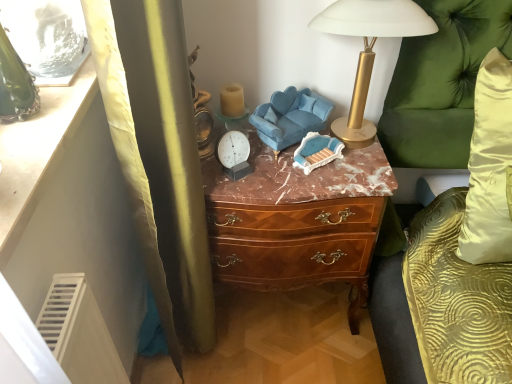
At what (x,y) coordinates should I click in order to perform the action: click on free spot to the right of velvet blue swivel chair at center. Please return your answer as a coordinate pair (x, y). Looking at the image, I should click on (362, 159).